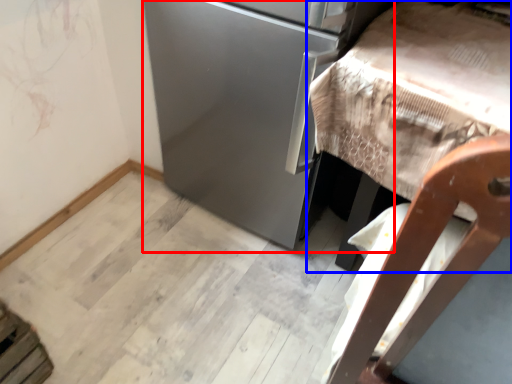
Question: Among these objects, which one is nearest to the camera, appliance (highlighted by a red box) or furniture (highlighted by a blue box)?

Choices:
 (A) appliance
 (B) furniture

Answer: (B)